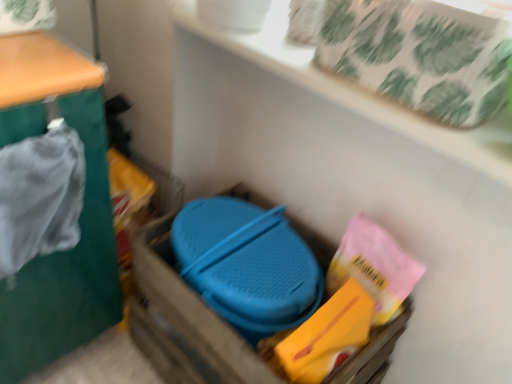
Question: Is white textured tray at upper center not close to green fabric at left?

Choices:
 (A) yes
 (B) no

Answer: (B)

Question: Is the position of white textured tray at upper center more distant than that of green fabric at left?

Choices:
 (A) yes
 (B) no

Answer: (A)

Question: Is white textured tray at upper center placed right next to green fabric at left?

Choices:
 (A) yes
 (B) no

Answer: (B)

Question: Is white textured tray at upper center taller than green fabric at left?

Choices:
 (A) yes
 (B) no

Answer: (B)

Question: From a real-world perspective, is white textured tray at upper center positioned over green fabric at left based on gravity?

Choices:
 (A) yes
 (B) no

Answer: (A)

Question: From a real-world perspective, is white textured tray at upper center located beneath green fabric at left?

Choices:
 (A) no
 (B) yes

Answer: (A)

Question: Is green fabric at left outside blue plastic container at center?

Choices:
 (A) yes
 (B) no

Answer: (A)

Question: Is green fabric at left positioned in front of blue plastic container at center?

Choices:
 (A) no
 (B) yes

Answer: (B)

Question: Does green fabric at left have a lesser height compared to blue plastic container at center?

Choices:
 (A) no
 (B) yes

Answer: (A)

Question: Is green fabric at left taller than blue plastic container at center?

Choices:
 (A) yes
 (B) no

Answer: (A)

Question: Is green fabric at left beside blue plastic container at center?

Choices:
 (A) no
 (B) yes

Answer: (A)

Question: From a real-world perspective, is green fabric at left beneath blue plastic container at center?

Choices:
 (A) no
 (B) yes

Answer: (A)

Question: Is green fabric at left at the back of blue plastic container at center?

Choices:
 (A) yes
 (B) no

Answer: (B)